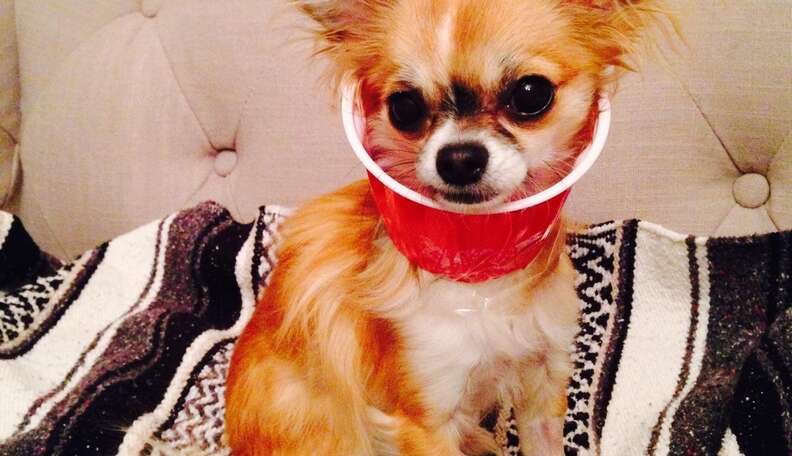
Where is `blanket`? blanket is located at coordinates (664, 364).